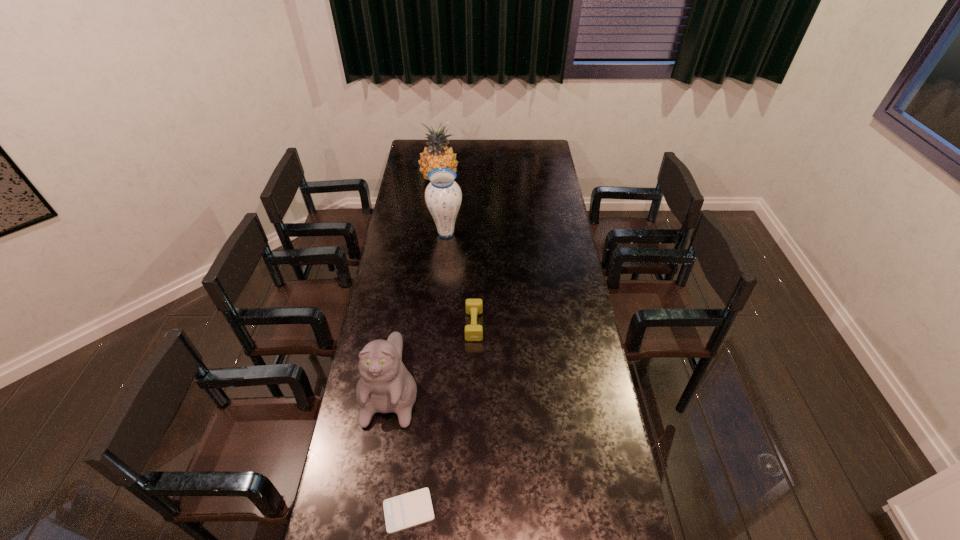
Where is `vacant region between the calculator and the farthest object`? The image size is (960, 540). vacant region between the calculator and the farthest object is located at coordinates [x=424, y=345].

Identify the location of free area in between the calculator and the rightmost object. (442, 418).

This screenshot has width=960, height=540. I want to click on unoccupied area between the second shortest object and the second farthest object, so click(x=460, y=279).

You are a GUI agent. You are given a task and a screenshot of the screen. Output one action in this format:
    pyautogui.click(x=<x>, y=<y>)
    Task: Click on the free space between the fourth tallest object and the nearest object
    The height and width of the screenshot is (540, 960).
    Given the screenshot: What is the action you would take?
    pyautogui.click(x=442, y=418)

This screenshot has width=960, height=540. In order to click on free space that is in between the second farthest object and the cat in this screenshot , I will do 419,307.

Identify the location of free spot between the dumbbell and the calculator. (442, 418).

Locate an element on the screen. This screenshot has height=540, width=960. free space between the second farthest object and the shortest object is located at coordinates (427, 372).

You are a GUI agent. You are given a task and a screenshot of the screen. Output one action in this format:
    pyautogui.click(x=<x>, y=<y>)
    Task: Click on the vacant area that lies between the calculator and the fourth tallest object
    The image size is (960, 540).
    Given the screenshot: What is the action you would take?
    pyautogui.click(x=442, y=418)

The image size is (960, 540). I want to click on free space between the cat and the second farthest object, so click(x=419, y=307).

Choose which object is the second nearest neighbor to the fourth nearest object. Please provide its 2D coordinates. Your answer should be formatted as a tuple, i.e. [(x, y)], where the tuple contains the x and y coordinates of a point satisfying the conditions above.

[(473, 332)]